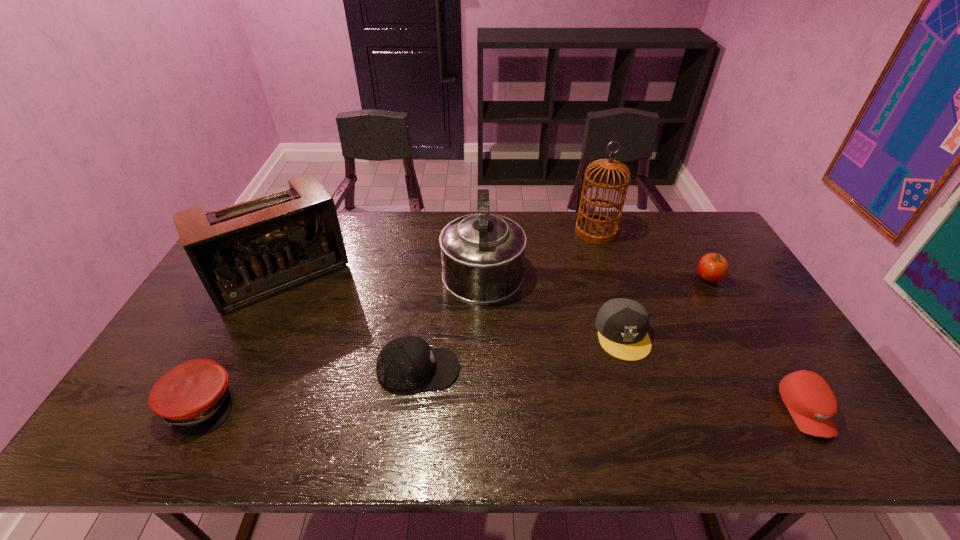
Find the location of a particular element. This screenshot has width=960, height=540. cap that is the closest to the tallest object is located at coordinates (622, 324).

Identify which cap is located as the second nearest to the kettle. Please provide its 2D coordinates. Your answer should be formatted as a tuple, i.e. [(x, y)], where the tuple contains the x and y coordinates of a point satisfying the conditions above.

[(622, 324)]

Identify the location of free space in the image that satisfies the following two spatial constraints: 1. on the front-facing side of the second cap from right to left; 2. on the front-facing side of the second cap from left to right. Image resolution: width=960 pixels, height=540 pixels. (634, 369).

You are a GUI agent. You are given a task and a screenshot of the screen. Output one action in this format:
    pyautogui.click(x=<x>, y=<y>)
    Task: Click on the free space that satisfies the following two spatial constraints: 1. on the front side of the apple; 2. at the front of the leftmost cap where the visor is located
    
    Given the screenshot: What is the action you would take?
    pyautogui.click(x=780, y=404)

The image size is (960, 540). I want to click on vacant region that satisfies the following two spatial constraints: 1. on the front side of the birdcage; 2. at the front of the leftmost cap where the visor is located, so click(x=653, y=404).